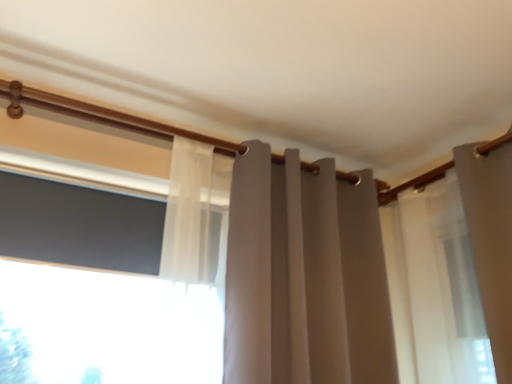
Question: Is matte gray curtain at center further to camera compared to black matte window screen at left?

Choices:
 (A) no
 (B) yes

Answer: (A)

Question: Does matte gray curtain at center have a lesser width compared to black matte window screen at left?

Choices:
 (A) no
 (B) yes

Answer: (A)

Question: Is matte gray curtain at center to the right of black matte window screen at left from the viewer's perspective?

Choices:
 (A) no
 (B) yes

Answer: (B)

Question: Would you say matte gray curtain at center contains black matte window screen at left?

Choices:
 (A) no
 (B) yes

Answer: (A)

Question: Is matte gray curtain at center in front of black matte window screen at left?

Choices:
 (A) no
 (B) yes

Answer: (B)

Question: Can you confirm if matte gray curtain at center is bigger than black matte window screen at left?

Choices:
 (A) yes
 (B) no

Answer: (A)

Question: Considering the relative positions of black matte window screen at left and matte gray curtain at center in the image provided, is black matte window screen at left to the left of matte gray curtain at center from the viewer's perspective?

Choices:
 (A) yes
 (B) no

Answer: (A)

Question: From the image's perspective, is black matte window screen at left over matte gray curtain at center?

Choices:
 (A) yes
 (B) no

Answer: (A)

Question: Is black matte window screen at left aimed at matte gray curtain at center?

Choices:
 (A) yes
 (B) no

Answer: (B)

Question: Is black matte window screen at left further to camera compared to matte gray curtain at center?

Choices:
 (A) no
 (B) yes

Answer: (B)

Question: Considering the relative positions of black matte window screen at left and matte gray curtain at center in the image provided, is black matte window screen at left to the right of matte gray curtain at center from the viewer's perspective?

Choices:
 (A) no
 (B) yes

Answer: (A)

Question: Is black matte window screen at left positioned beyond the bounds of matte gray curtain at center?

Choices:
 (A) yes
 (B) no

Answer: (A)

Question: From a real-world perspective, relative to black matte window screen at left, is matte gray curtain at center vertically above or below?

Choices:
 (A) above
 (B) below

Answer: (B)